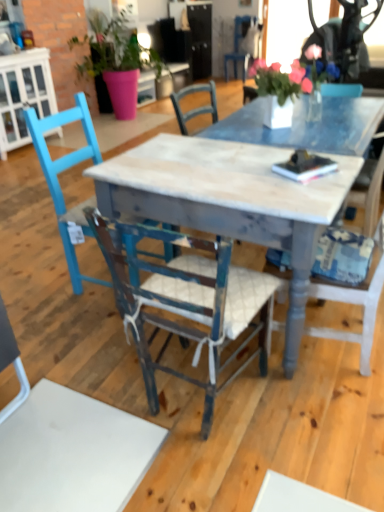
This screenshot has width=384, height=512. I want to click on vacant region above distressed wood desk at center (from a real-world perspective), so click(226, 161).